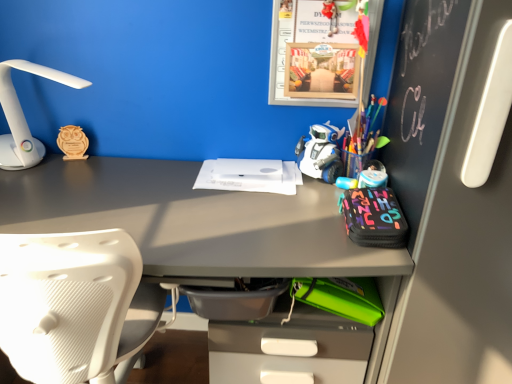
What do you see at coordinates (73, 142) in the screenshot?
I see `wooden owl at left` at bounding box center [73, 142].

What do you see at coordinates (321, 153) in the screenshot? I see `white plastic robot at center` at bounding box center [321, 153].

You are a GUI agent. You are given a task and a screenshot of the screen. Output one action in this format:
    pyautogui.click(x=<x>, y=<y>)
    Task: Click on the white plastic lamp at left
    The height and width of the screenshot is (384, 512).
    Given the screenshot: What is the action you would take?
    pyautogui.click(x=23, y=115)

Between white plastic lamp at left and matte gray desk at center, which one has larger width?

matte gray desk at center.

Between white plastic lamp at left and matte gray desk at center, which one has less height?

white plastic lamp at left.

From the picture: Is white plastic lamp at left to the left of matte gray desk at center from the viewer's perspective?

Correct, you'll find white plastic lamp at left to the left of matte gray desk at center.

Does point (56, 74) appear closer or farther from the camera than point (204, 192)?

Point (56, 74) is positioned closer to the camera compared to point (204, 192).

Between wooden owl at left and white textured chair at left, which one has larger size?

white textured chair at left is bigger.

In the image, is wooden owl at left positioned in front of or behind white textured chair at left?

wooden owl at left is positioned farther from the viewer than white textured chair at left.

Is wooden owl at left taller than white textured chair at left?

Incorrect, the height of wooden owl at left is not larger of that of white textured chair at left.

Visually, is wooden owl at left positioned to the left or to the right of white textured chair at left?

Based on their positions, wooden owl at left is located to the left of white textured chair at left.

Does white matte paper at center turn towards white plastic lamp at left?

No.

Which object is thinner, white matte paper at center or white plastic lamp at left?

white plastic lamp at left.

Which of these two, white matte paper at center or white plastic lamp at left, is bigger?

white plastic lamp at left is bigger.

Considering the sizes of white textured chair at left and white matte paper at center in the image, is white textured chair at left taller or shorter than white matte paper at center?

white textured chair at left is taller than white matte paper at center.

Choose the correct answer: Is white textured chair at left inside white matte paper at center or outside it?

white textured chair at left exists outside the volume of white matte paper at center.

Is there a large distance between white textured chair at left and white matte paper at center?

No.

Does point (101, 352) come farther from viewer compared to point (283, 188)?

No, it is not.

Considering the sizes of objects white plastic lamp at left and white plastic robot at center in the image provided, who is bigger, white plastic lamp at left or white plastic robot at center?

white plastic lamp at left.

From a real-world perspective, is white plastic lamp at left on white plastic robot at center?

Yes.

From a real-world perspective, is white matte paper at center beneath wooden owl at left?

Yes, from a real-world perspective, white matte paper at center is under wooden owl at left.

Is white matte paper at center facing towards wooden owl at left?

No.

Is white matte paper at center directly adjacent to wooden owl at left?

No, white matte paper at center is not next to wooden owl at left.

Locate an element on the screen. The width and height of the screenshot is (512, 384). office supplies located in front of the wooden owl at left is located at coordinates (248, 178).

Is point (81, 79) farther from viewer compared to point (275, 190)?

That is False.

From a real-world perspective, is white plastic lamp at left physically below white matte paper at center?

No, from a real-world perspective, white plastic lamp at left is not under white matte paper at center.

Consider the image. Considering their positions, is white plastic lamp at left located in front of or behind white matte paper at center?

white plastic lamp at left is positioned closer to the viewer than white matte paper at center.

The height and width of the screenshot is (384, 512). In order to click on desk below the white plastic lamp at left (from a real-world perspective) in this screenshot , I will do `click(200, 224)`.

Find the location of a particular element. stationery on the left side of white textured chair at left is located at coordinates (73, 142).

Estimate the real-world distances between objects in this image. Which object is further from white textured chair at left, white plastic robot at center or white plastic lamp at left?

Based on the image, white plastic robot at center appears to be further to white textured chair at left.

In the scene shown: Considering their positions, is wooden owl at left positioned further to matte gray desk at center than white plastic lamp at left?

wooden owl at left is positioned further to the anchor matte gray desk at center.

Considering their positions, is white textured chair at left positioned closer to white plastic robot at center than wooden owl at left?

Based on the image, white textured chair at left appears to be nearer to white plastic robot at center.

When comparing their distances from matte gray desk at center, does white textured chair at left or wooden owl at left seem closer?

white textured chair at left is closer to matte gray desk at center.

Which object lies further to the anchor point white plastic lamp at left, white textured chair at left or wooden owl at left?

Among the two, white textured chair at left is located further to white plastic lamp at left.

When comparing their distances from white plastic lamp at left, does white matte paper at center or wooden owl at left seem further?

white matte paper at center.

Considering their positions, is wooden owl at left positioned further to matte gray desk at center than white matte paper at center?

wooden owl at left is positioned further to the anchor matte gray desk at center.

Based on their spatial positions, is white plastic robot at center or matte gray desk at center closer to white plastic lamp at left?

matte gray desk at center is positioned closer to the anchor white plastic lamp at left.

This screenshot has height=384, width=512. I want to click on desk between white textured chair at left and white matte paper at center along the z-axis, so click(x=200, y=224).

You are a GUI agent. You are given a task and a screenshot of the screen. Output one action in this format:
    pyautogui.click(x=<x>, y=<y>)
    Task: Click on the office supplies between white plastic lamp at left and white plastic robot at center in the horizontal direction
    The width and height of the screenshot is (512, 384).
    Given the screenshot: What is the action you would take?
    pyautogui.click(x=248, y=178)

This screenshot has width=512, height=384. What are the coordinates of `desk located between white plastic lamp at left and white matte paper at center in the left-right direction` in the screenshot? It's located at [200, 224].

The image size is (512, 384). Identify the location of desk between wooden owl at left and white matte paper at center. (200, 224).